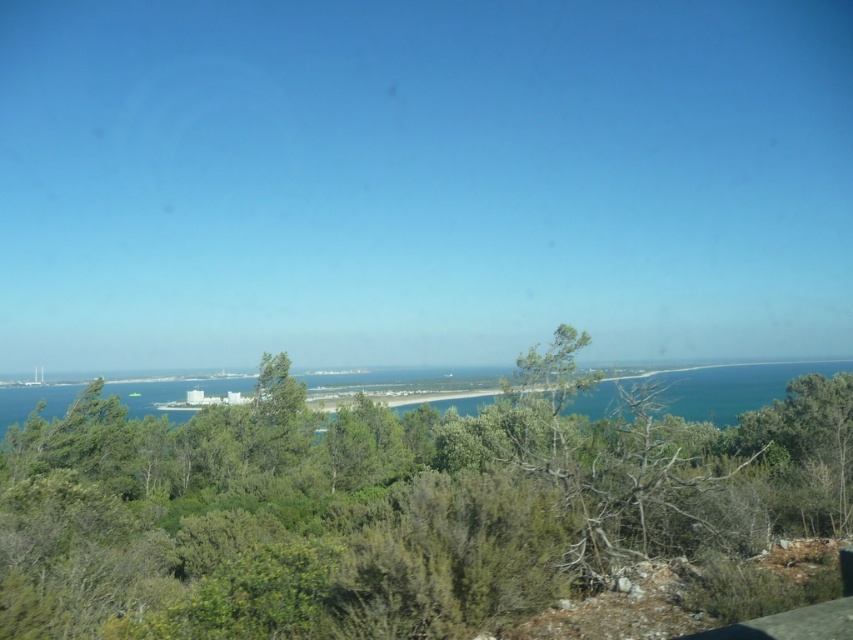
Question: Can you confirm if green leafy tree at center is positioned above blue water at center?

Choices:
 (A) yes
 (B) no

Answer: (A)

Question: In this image, where is green leafy tree at center located relative to blue water at center?

Choices:
 (A) left
 (B) right

Answer: (A)

Question: Which of the following is the farthest from the observer?

Choices:
 (A) (149, 400)
 (B) (550, 525)

Answer: (A)

Question: In this image, where is green leafy tree at center located relative to blue water at center?

Choices:
 (A) below
 (B) above

Answer: (B)

Question: Which object appears closest to the camera in this image?

Choices:
 (A) blue water at center
 (B) green leafy tree at center

Answer: (B)